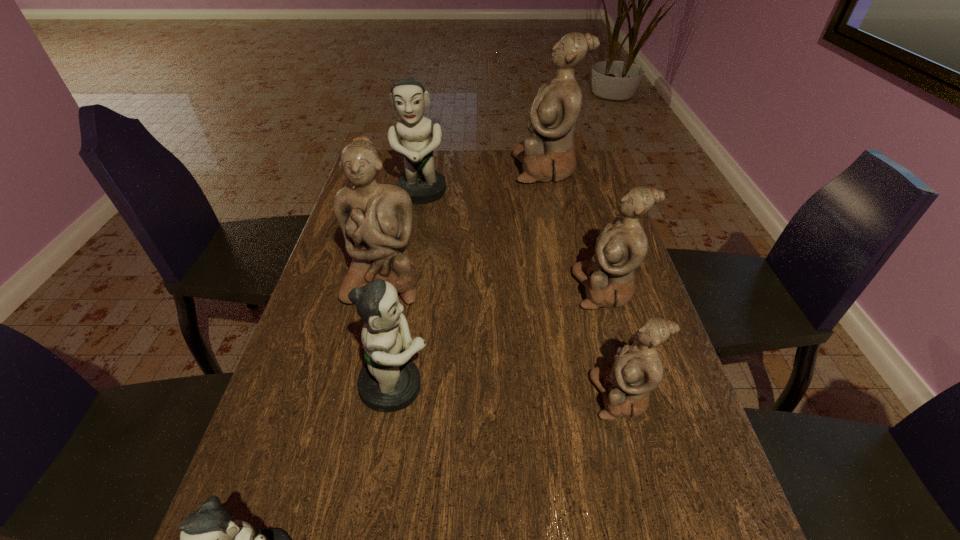
This screenshot has width=960, height=540. Find the location of `free space located on the front-facing side of the farthest green figurine`. free space located on the front-facing side of the farthest green figurine is located at coordinates (406, 282).

This screenshot has height=540, width=960. I want to click on free spot located on the front-facing side of the leftmost white figurine, so click(368, 347).

Where is `vacant space located on the front-facing side of the second nearest green figurine`? vacant space located on the front-facing side of the second nearest green figurine is located at coordinates (606, 386).

At what (x,y) coordinates should I click in order to perform the action: click on vacant region located 0.340m on the front-facing side of the third biggest white figurine. Please return your answer as a coordinate pair (x, y). The height and width of the screenshot is (540, 960). Looking at the image, I should click on (444, 289).

This screenshot has height=540, width=960. Identify the location of free space located 0.210m on the front-facing side of the third biggest white figurine. (493, 289).

Where is `vacant area situated on the front-facing side of the third biggest white figurine`? The image size is (960, 540). vacant area situated on the front-facing side of the third biggest white figurine is located at coordinates (536, 289).

What are the coordinates of `free space located on the front-facing side of the smallest white figurine` in the screenshot? It's located at (405, 396).

Find the location of `free region located on the front-facing side of the smallest white figurine`. free region located on the front-facing side of the smallest white figurine is located at coordinates (501, 396).

The image size is (960, 540). Find the location of `vacant space situated on the front-facing side of the smallest white figurine`. vacant space situated on the front-facing side of the smallest white figurine is located at coordinates (511, 396).

At what (x,y) coordinates should I click in order to perform the action: click on object located at the far left corner. Please return your answer as a coordinate pair (x, y). Looking at the image, I should click on (424, 185).